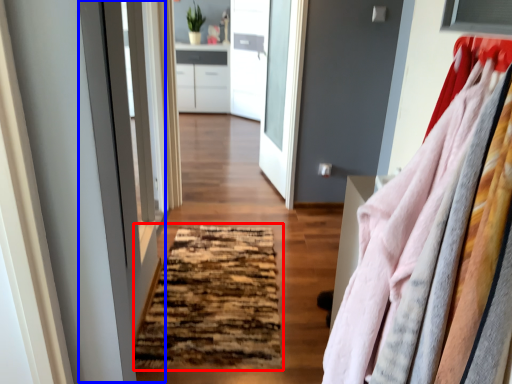
Question: Among these objects, which one is farthest to the camera, mat (highlighted by a red box) or screen door (highlighted by a blue box)?

Choices:
 (A) mat
 (B) screen door

Answer: (A)